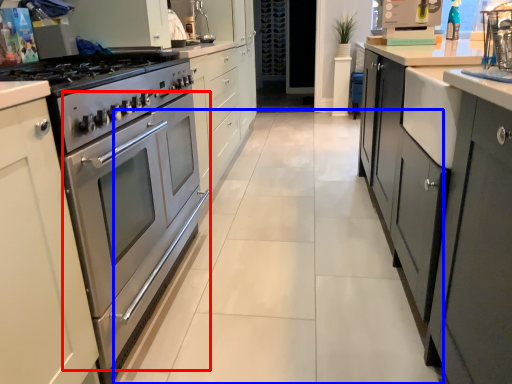
Question: Which of the following is the closest to the observer, oven (highlighted by a red box) or plain (highlighted by a blue box)?

Choices:
 (A) oven
 (B) plain

Answer: (A)